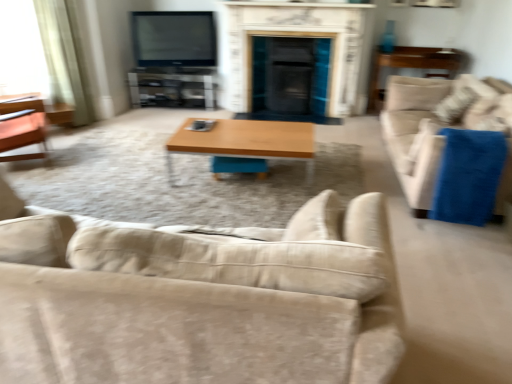
Question: Should I look upward or downward to see beige fabric couch at right, which is counted as the first studio couch, starting from the right?

Choices:
 (A) down
 (B) up

Answer: (B)

Question: From the image's perspective, is white marble fireplace at center over beige fabric couch at lower center, which is counted as the second studio couch, starting from the back?

Choices:
 (A) yes
 (B) no

Answer: (A)

Question: Is white marble fireplace at center at the left side of beige fabric couch at lower center, the 1th studio couch when ordered from front to back?

Choices:
 (A) yes
 (B) no

Answer: (B)

Question: Is white marble fireplace at center positioned with its back to beige fabric couch at lower center, the second studio couch in the right-to-left sequence?

Choices:
 (A) yes
 (B) no

Answer: (B)

Question: Is white marble fireplace at center wider than beige fabric couch at lower center, the 1th studio couch when ordered from front to back?

Choices:
 (A) yes
 (B) no

Answer: (B)

Question: Does white marble fireplace at center have a lesser height compared to beige fabric couch at lower center, which is counted as the second studio couch, starting from the back?

Choices:
 (A) no
 (B) yes

Answer: (A)

Question: Does white marble fireplace at center have a lesser width compared to beige fabric couch at lower center, the 1th studio couch when ordered from front to back?

Choices:
 (A) yes
 (B) no

Answer: (A)

Question: Is light beige fabric curtain at left to the left of wooden side table at right from the viewer's perspective?

Choices:
 (A) yes
 (B) no

Answer: (A)

Question: Is light beige fabric curtain at left bigger than wooden side table at right?

Choices:
 (A) no
 (B) yes

Answer: (A)

Question: Is light beige fabric curtain at left to the right of wooden side table at right from the viewer's perspective?

Choices:
 (A) yes
 (B) no

Answer: (B)

Question: Considering the relative sizes of light beige fabric curtain at left and wooden side table at right in the image provided, is light beige fabric curtain at left wider than wooden side table at right?

Choices:
 (A) yes
 (B) no

Answer: (B)

Question: From the image's perspective, is light beige fabric curtain at left below wooden side table at right?

Choices:
 (A) yes
 (B) no

Answer: (B)

Question: Are light beige fabric curtain at left and wooden side table at right beside each other?

Choices:
 (A) no
 (B) yes

Answer: (A)

Question: Can you confirm if wooden/matte coffee table at center is taller than beige fabric couch at right, placed as the second studio couch when sorted from front to back?

Choices:
 (A) yes
 (B) no

Answer: (B)